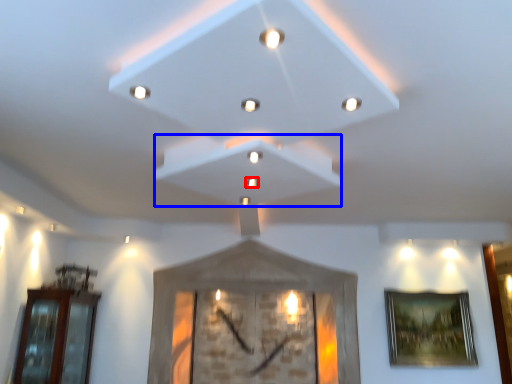
Question: Which point is closer to the camera, light (highlighted by a red box) or exhaust hood (highlighted by a blue box)?

Choices:
 (A) light
 (B) exhaust hood

Answer: (B)